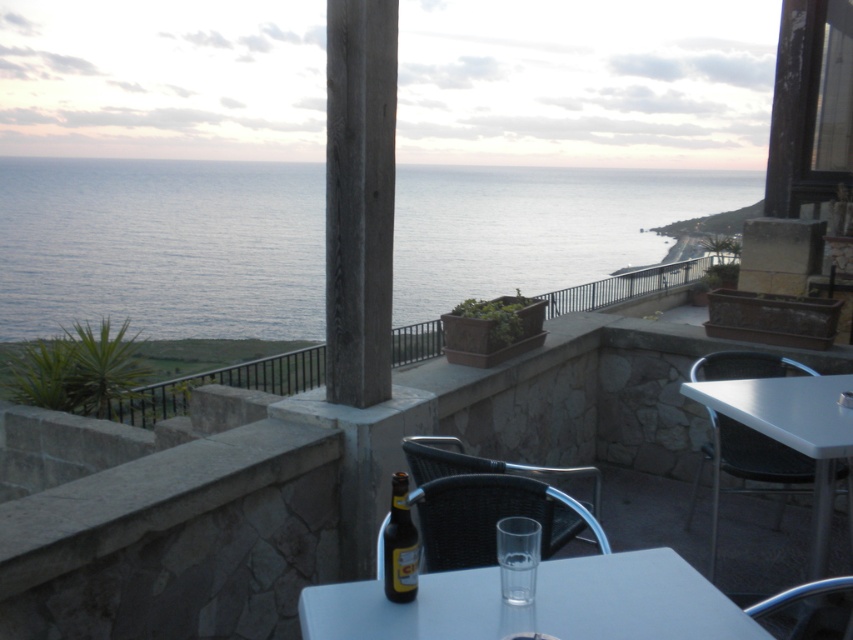
Does black wicker chair at center appear on the left side of brown glass bottle at lower center?

Incorrect, black wicker chair at center is not on the left side of brown glass bottle at lower center.

Does black wicker chair at center have a smaller size compared to brown glass bottle at lower center?

Actually, black wicker chair at center might be larger than brown glass bottle at lower center.

Between point (430, 460) and point (393, 595), which one is positioned in front?

Point (393, 595) is more forward.

The image size is (853, 640). What are the coordinates of `black wicker chair at center` in the screenshot? It's located at (489, 502).

Between brown glass bottle at lower center and clear glass at table center, which one is positioned lower?

brown glass bottle at lower center is below.

Is brown glass bottle at lower center bigger than clear glass at table center?

Indeed, brown glass bottle at lower center has a larger size compared to clear glass at table center.

Does point (405, 502) come closer to viewer compared to point (511, 588)?

No.

You are a GUI agent. You are given a task and a screenshot of the screen. Output one action in this format:
    pyautogui.click(x=<x>, y=<y>)
    Task: Click on the brown glass bottle at lower center
    This screenshot has height=640, width=853.
    Given the screenshot: What is the action you would take?
    pyautogui.click(x=399, y=545)

Between blue water at upper left and smooth concrete pillar at center, which one is positioned higher?

Positioned higher is blue water at upper left.

Describe the element at coordinates (161, 248) in the screenshot. I see `blue water at upper left` at that location.

Locate an element on the screen. blue water at upper left is located at coordinates (161, 248).